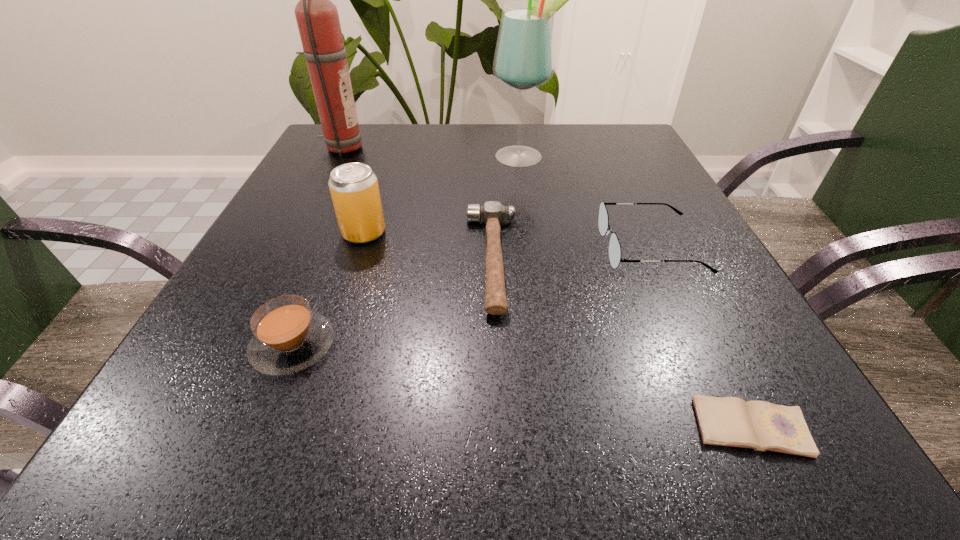
Image resolution: width=960 pixels, height=540 pixels. Identify the location of free space between the spectacles and the pop (soda). (507, 240).

I want to click on free spot between the diary and the spectacles, so click(701, 338).

This screenshot has width=960, height=540. I want to click on vacant point located between the spectacles and the hammer, so click(571, 254).

Where is `the closest object to the spectacles`? The height and width of the screenshot is (540, 960). the closest object to the spectacles is located at coordinates (492, 213).

Where is `the third closest object to the spectacles`? The width and height of the screenshot is (960, 540). the third closest object to the spectacles is located at coordinates (728, 421).

The height and width of the screenshot is (540, 960). Find the location of `free region that satisfies the following two spatial constraints: 1. on the side of the fire extinguisher with the label and nozzle; 2. on the right side of the alcohol`. free region that satisfies the following two spatial constraints: 1. on the side of the fire extinguisher with the label and nozzle; 2. on the right side of the alcohol is located at coordinates (337, 157).

Find the location of a particular element. vacant space that satisfies the following two spatial constraints: 1. on the lenses of the spectacles; 2. on the back side of the shortest object is located at coordinates (732, 427).

Locate an element on the screen. The height and width of the screenshot is (540, 960). vacant region that satisfies the following two spatial constraints: 1. on the side of the fire extinguisher with the label and nozzle; 2. on the right side of the cappuccino is located at coordinates (240, 345).

Locate an element on the screen. free space that satisfies the following two spatial constraints: 1. on the lenses of the spectacles; 2. on the left side of the shortest object is located at coordinates (732, 427).

Where is `free space that satisfies the following two spatial constraints: 1. on the lenses of the spectacles; 2. on the right side of the nearest object`? The width and height of the screenshot is (960, 540). free space that satisfies the following two spatial constraints: 1. on the lenses of the spectacles; 2. on the right side of the nearest object is located at coordinates (732, 427).